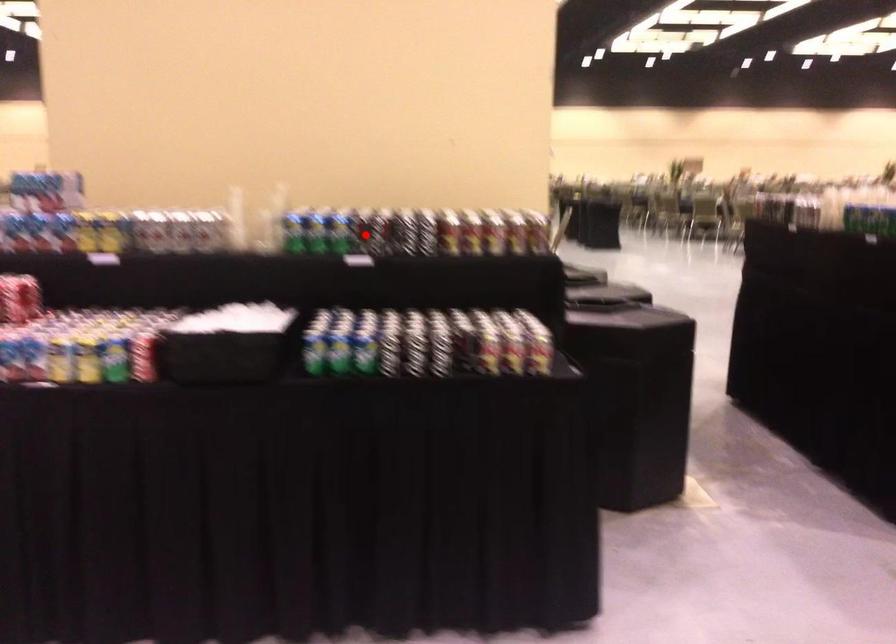
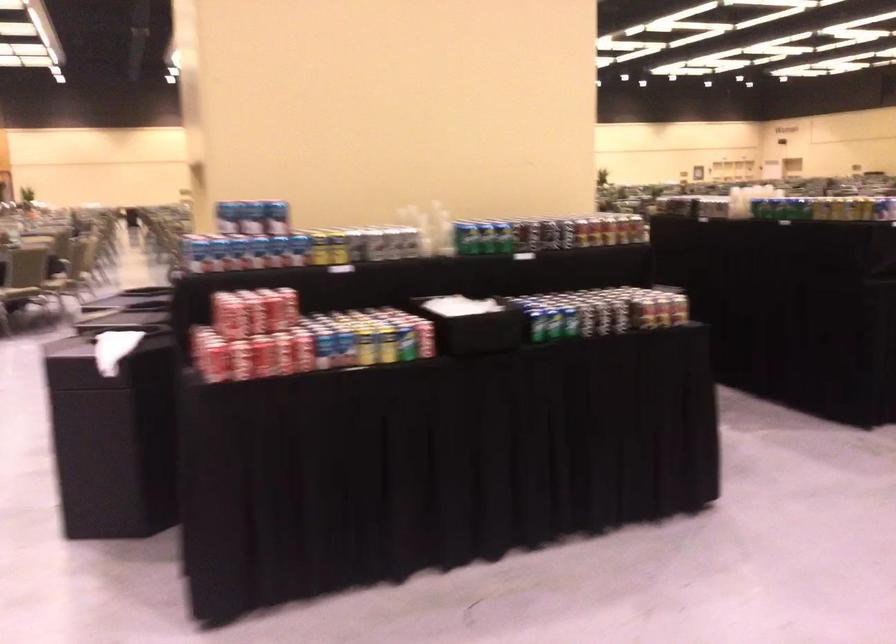
Question: I am providing you with two images of the same scene from different viewpoints. Given a red point in image1, look at the same physical point in image2. Is it:

Choices:
 (A) Closer to the viewpoint
 (B) Farther from the viewpoint

Answer: (B)